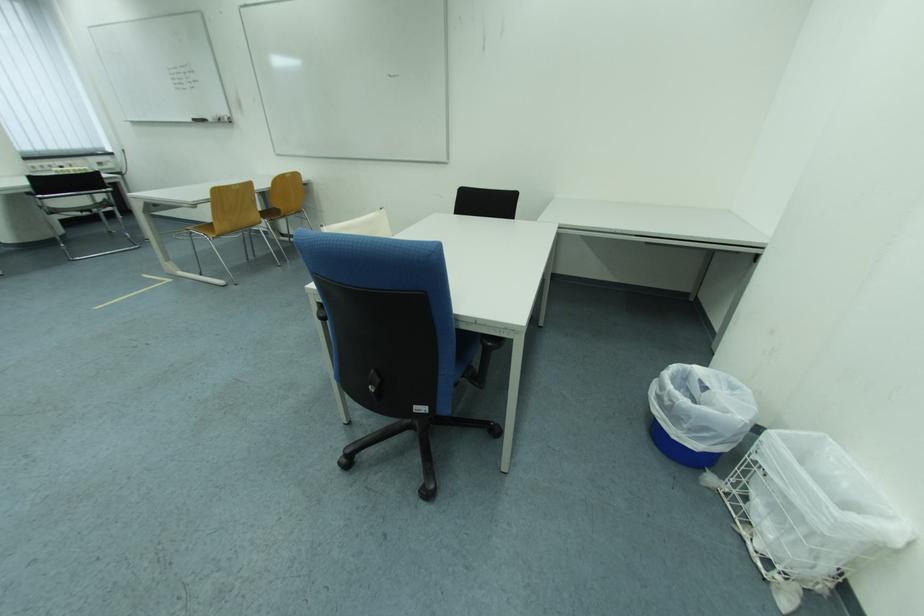
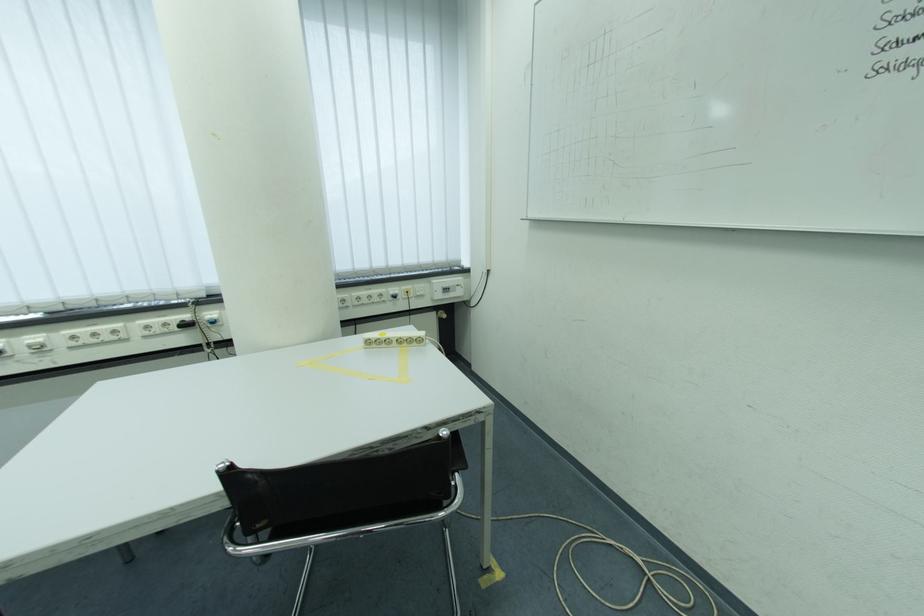
Where in the second image is the point corresponding to pixel 108 167 from the first image?

(455, 292)